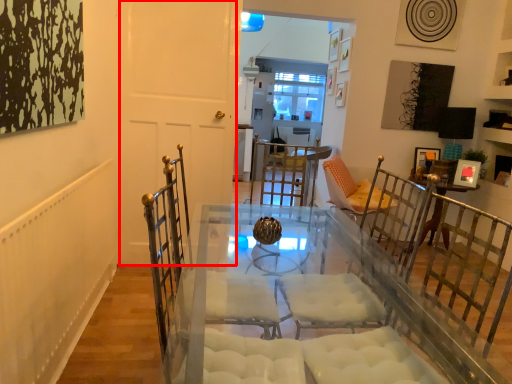
Question: From the image's perspective, considering the relative positions of door (annotated by the red box) and picture frame in the image provided, where is door (annotated by the red box) located with respect to the staircase?

Choices:
 (A) below
 (B) above

Answer: (B)